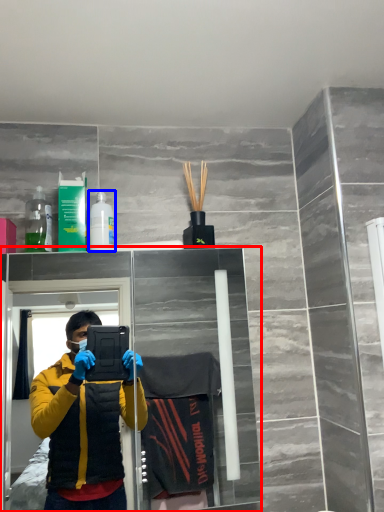
Question: Among these objects, which one is farthest to the camera, glass door (highlighted by a red box) or toiletry (highlighted by a blue box)?

Choices:
 (A) glass door
 (B) toiletry

Answer: (B)